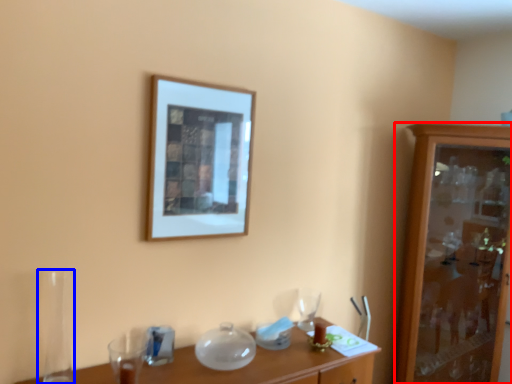
Question: Which point is further to the camera, cabinetry (highlighted by a red box) or glass vase (highlighted by a blue box)?

Choices:
 (A) cabinetry
 (B) glass vase

Answer: (A)